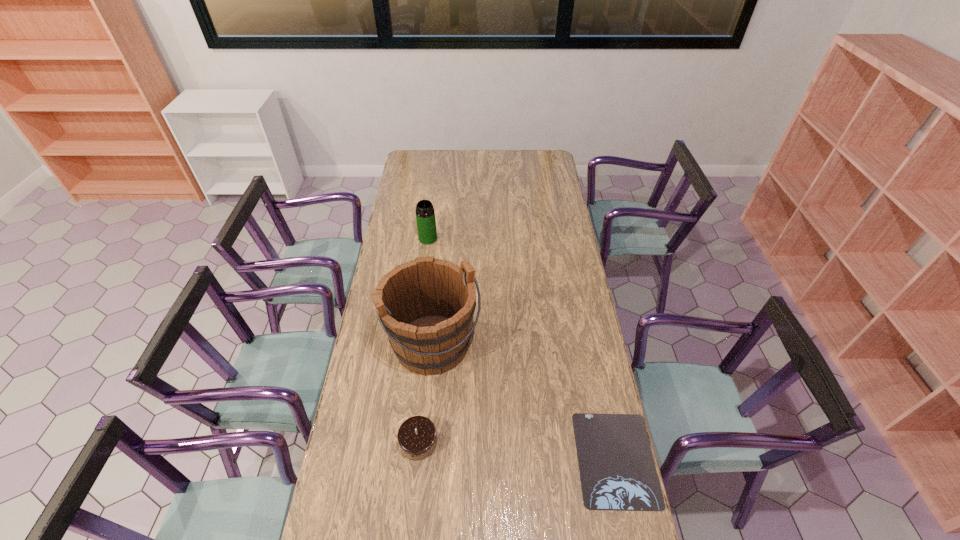
Locate an element on the screen. vacant space on the desktop that is between the third tallest object and the rightmost object and is positioned from the spout of the third shortest object is located at coordinates (492, 448).

Image resolution: width=960 pixels, height=540 pixels. Find the location of `vacant space on the desktop that is between the second shortest object and the mousepad and is positioned on the side of the wine bucket with the handle for carrying`. vacant space on the desktop that is between the second shortest object and the mousepad and is positioned on the side of the wine bucket with the handle for carrying is located at coordinates (493, 448).